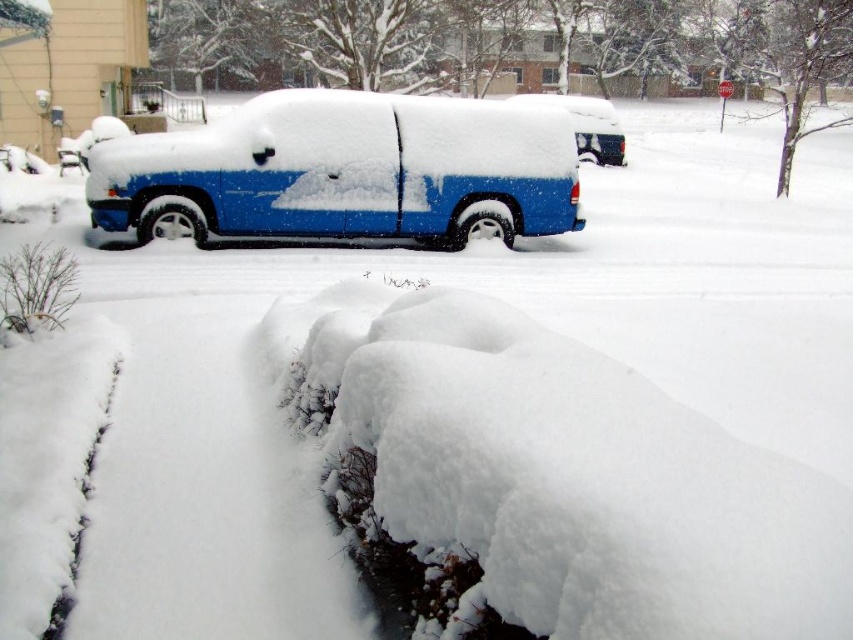
You are standing at the origin point of the image coordinate system. Where is the blue matte van at center located in terms of coordinates?

The blue matte van at center is located at coordinates point (x=345, y=170).

You are a delivery driver who needs to park your vehicle on the street. You see the blue matte van at upper center and the white snow curb at lower left. Which one is taller and should be avoided to prevent damage?

The blue matte van at upper center is taller than the white snow curb at lower left. Therefore, the blue matte van at upper center should be avoided to prevent damage as it is taller and may hit obstacles.

You are standing in the snowy garden bed with low shrubs and want to walk towards the blue matte van at upper center. Which direction should you head relative to the blue matte van at center?

You should head to the right relative to the blue matte van at center because the blue matte van at upper center is to the right of it.